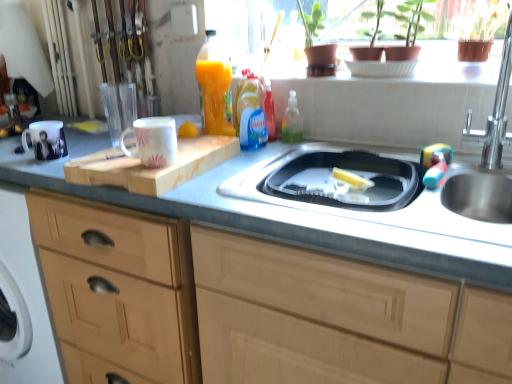
Where is `vacant area that is situated to the right of wooden cutting board at center`? The image size is (512, 384). vacant area that is situated to the right of wooden cutting board at center is located at coordinates (251, 158).